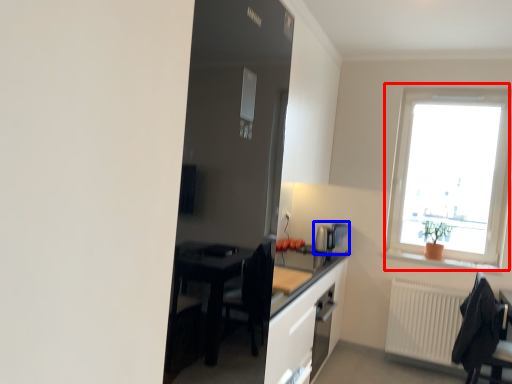
Question: Which point is closer to the camera, window (highlighted by a red box) or coffee machine (highlighted by a blue box)?

Choices:
 (A) window
 (B) coffee machine

Answer: (A)